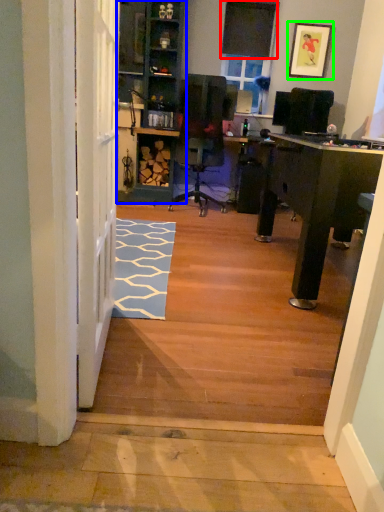
Question: Which object is the closest to the window screen (highlighted by a red box)? Choose among these: bookshelf (highlighted by a blue box) or picture frame (highlighted by a green box).

Choices:
 (A) bookshelf
 (B) picture frame

Answer: (B)